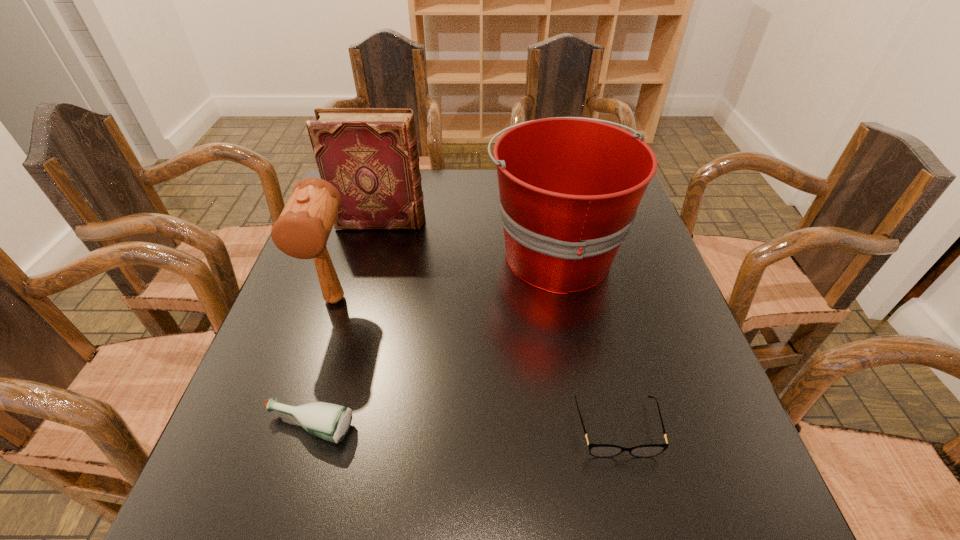
Identify the location of free space between the bottle and the bucket. The width and height of the screenshot is (960, 540). (432, 341).

Locate an element on the screen. The image size is (960, 540). object identified as the fourth closest to the mallet is located at coordinates (597, 450).

Where is `the second closest object to the hardback book`? This screenshot has height=540, width=960. the second closest object to the hardback book is located at coordinates (302, 230).

This screenshot has width=960, height=540. I want to click on vacant space that satisfies the following two spatial constraints: 1. on the spine side of the hardback book; 2. on the right side of the bucket, so click(373, 254).

The image size is (960, 540). In order to click on vacant space that satisfies the following two spatial constraints: 1. on the spine side of the hardback book; 2. on the strike surface of the mallet in this screenshot , I will do `click(361, 300)`.